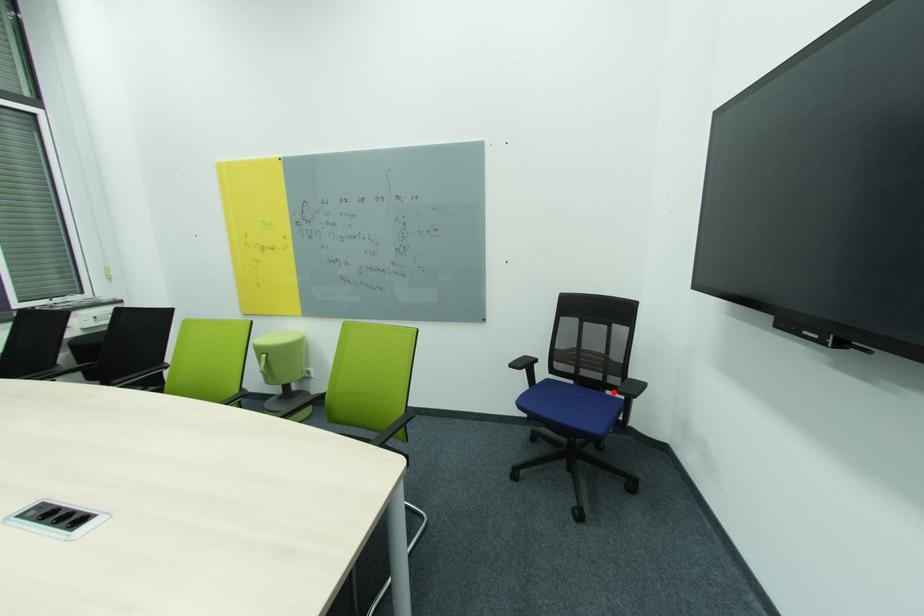
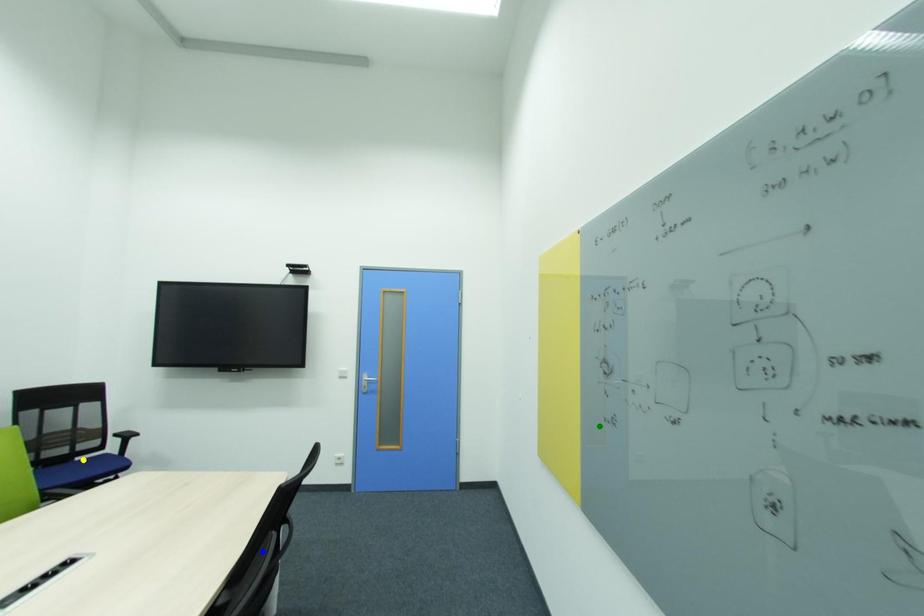
Question: I am providing you with two images of the same scene from different viewpoints. A red point is marked on the first image. You are given multiple points on the second image. Which point in image 2 is actually the same real-world point as the red point in image 1?

Choices:
 (A) yellow point
 (B) blue point
 (C) green point

Answer: (A)